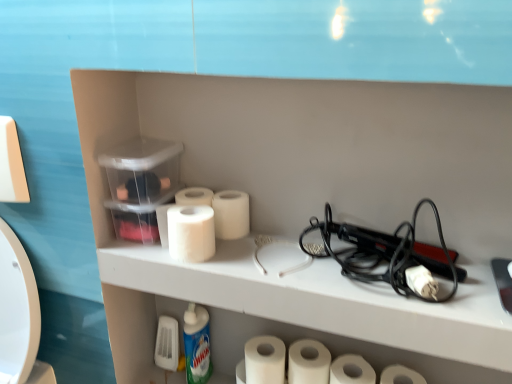
You are a GUI agent. You are given a task and a screenshot of the screen. Output one action in this format:
    pyautogui.click(x=<x>, y=<y>)
    Task: Click on the free area in between black plastic hair straightener at right and white matte toilet paper at center, which ranks as the 5th toilet paper in right-to-left order
    The height and width of the screenshot is (384, 512).
    Given the screenshot: What is the action you would take?
    pyautogui.click(x=267, y=246)